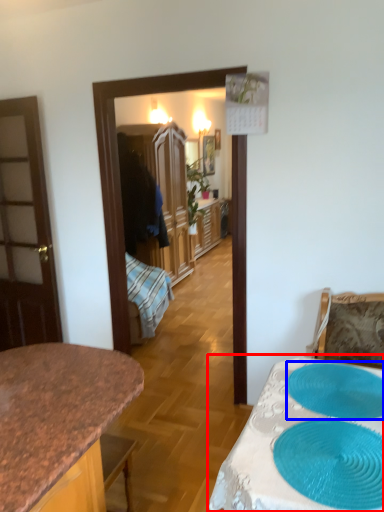
Question: Which object is further to the camera taking this photo, table (highlighted by a red box) or oval (highlighted by a blue box)?

Choices:
 (A) table
 (B) oval

Answer: (B)